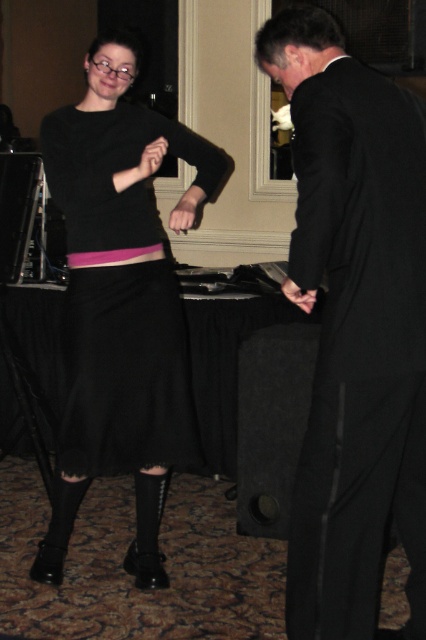
Question: Which object is farther from the camera taking this photo?

Choices:
 (A) pink fabric belt at center
 (B) matte black skirt at center

Answer: (A)

Question: In this image, where is matte black skirt at center located relative to pink fabric belt at center?

Choices:
 (A) below
 (B) above

Answer: (A)

Question: Which point appears closest to the camera in this image?

Choices:
 (A) (158, 122)
 (B) (129, 257)
 (C) (368, 180)

Answer: (C)

Question: Among these objects, which one is farthest from the camera?

Choices:
 (A) matte black skirt at center
 (B) black matte suit at right

Answer: (A)

Question: Is the position of matte black skirt at center less distant than that of pink fabric belt at center?

Choices:
 (A) yes
 (B) no

Answer: (A)

Question: Does black matte suit at right appear on the left side of matte black skirt at center?

Choices:
 (A) no
 (B) yes

Answer: (A)